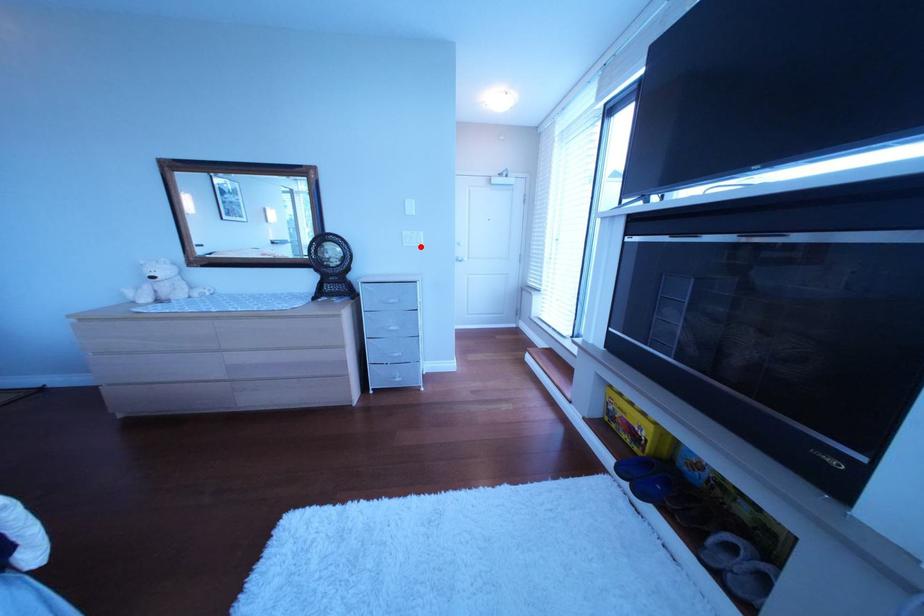
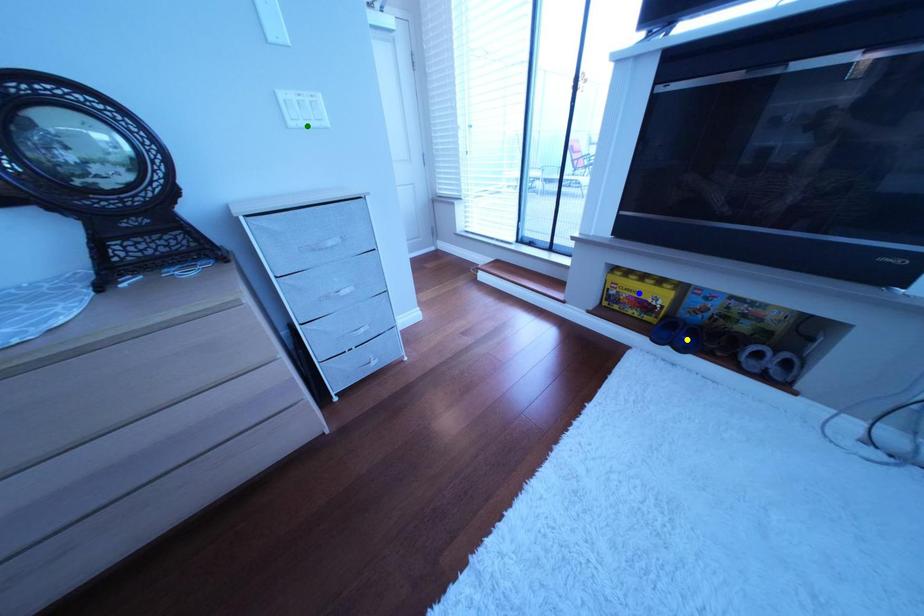
Question: I am providing you with two images of the same scene from different viewpoints. A red point is marked on the first image. You are given multiple points on the second image. In image 2, which mark is for the same physical point as the one in image 1?

Choices:
 (A) green point
 (B) blue point
 (C) yellow point

Answer: (A)